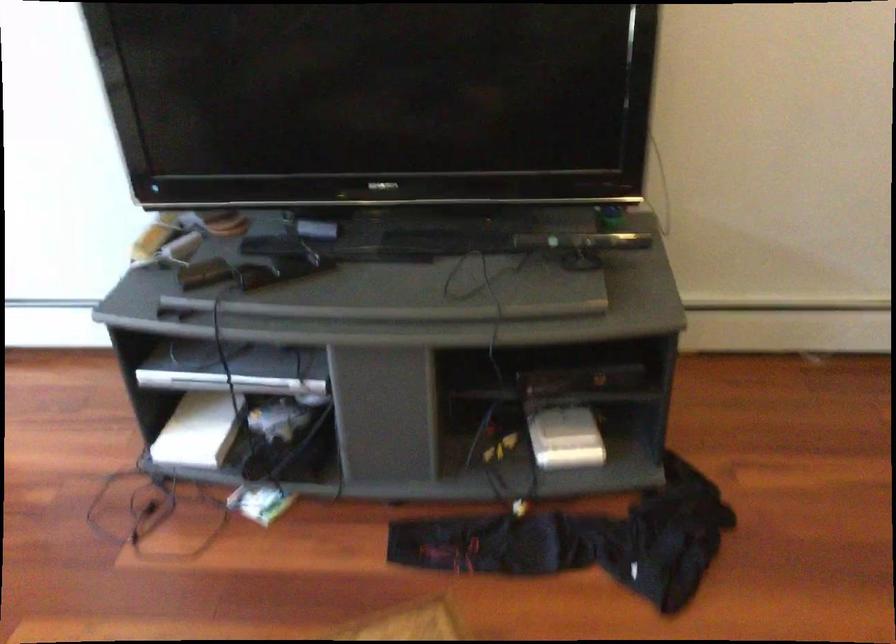
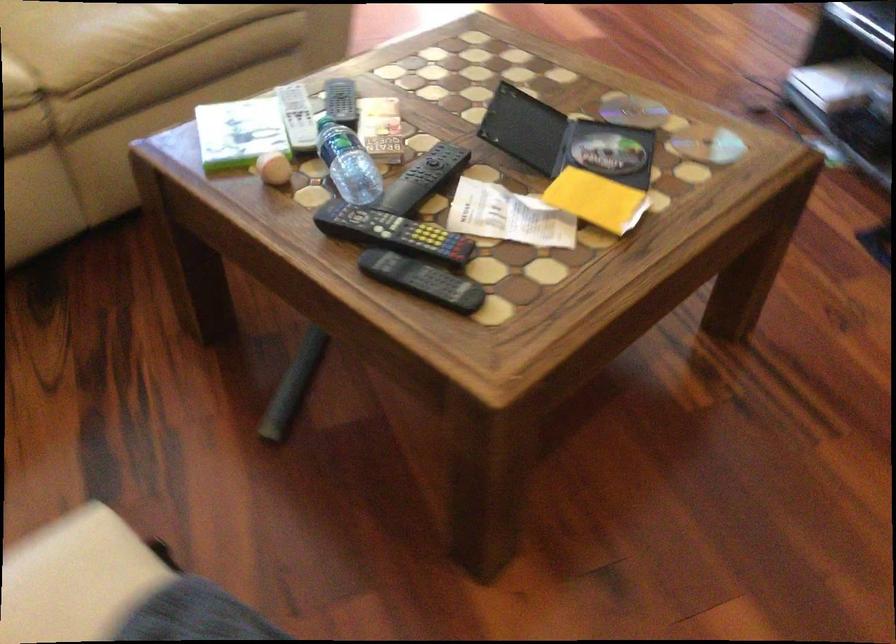
How did the camera likely rotate?

The rotation direction of the camera is left-down.